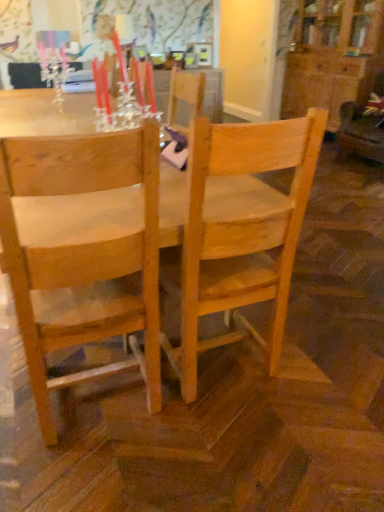
Question: Should I look upward or downward to see natural wood chair at left, which ranks as the second chair in right-to-left order?

Choices:
 (A) up
 (B) down

Answer: (B)

Question: Is matte glass candle holder at upper left further to the viewer compared to natural wood chair at left, which ranks as the second chair in right-to-left order?

Choices:
 (A) no
 (B) yes

Answer: (B)

Question: Is matte glass candle holder at upper left at the left side of natural wood chair at left, which ranks as the second chair in right-to-left order?

Choices:
 (A) yes
 (B) no

Answer: (A)

Question: Considering the relative sizes of matte glass candle holder at upper left and natural wood chair at left, which is the 1th chair from left to right, in the image provided, is matte glass candle holder at upper left wider than natural wood chair at left, which is the 1th chair from left to right,?

Choices:
 (A) no
 (B) yes

Answer: (A)

Question: From a real-world perspective, is matte glass candle holder at upper left located higher than natural wood chair at left, which ranks as the second chair in right-to-left order?

Choices:
 (A) yes
 (B) no

Answer: (A)

Question: Considering the relative sizes of matte glass candle holder at upper left and natural wood chair at left, which is the 1th chair from left to right, in the image provided, is matte glass candle holder at upper left bigger than natural wood chair at left, which is the 1th chair from left to right,?

Choices:
 (A) yes
 (B) no

Answer: (B)

Question: Is matte glass candle holder at upper left shorter than natural wood chair at left, which is the 1th chair from left to right?

Choices:
 (A) no
 (B) yes

Answer: (B)

Question: Can you confirm if natural wood chair at left, which ranks as the second chair in right-to-left order, is positioned to the left of velvet brown swivel chair at right?

Choices:
 (A) no
 (B) yes

Answer: (B)

Question: Does natural wood chair at left, which ranks as the second chair in right-to-left order, lie behind velvet brown swivel chair at right?

Choices:
 (A) yes
 (B) no

Answer: (B)

Question: Is natural wood chair at left, which ranks as the second chair in right-to-left order, not within velvet brown swivel chair at right?

Choices:
 (A) no
 (B) yes

Answer: (B)

Question: Could you tell me if natural wood chair at left, which is the 1th chair from left to right, is facing velvet brown swivel chair at right?

Choices:
 (A) no
 (B) yes

Answer: (A)

Question: Does natural wood chair at left, which ranks as the second chair in right-to-left order, have a greater width compared to velvet brown swivel chair at right?

Choices:
 (A) no
 (B) yes

Answer: (A)

Question: From a real-world perspective, is natural wood chair at left, which is the 1th chair from left to right, on velvet brown swivel chair at right?

Choices:
 (A) yes
 (B) no

Answer: (A)

Question: Is matte glass candle holder at upper left far from natural wood table at center?

Choices:
 (A) no
 (B) yes

Answer: (B)